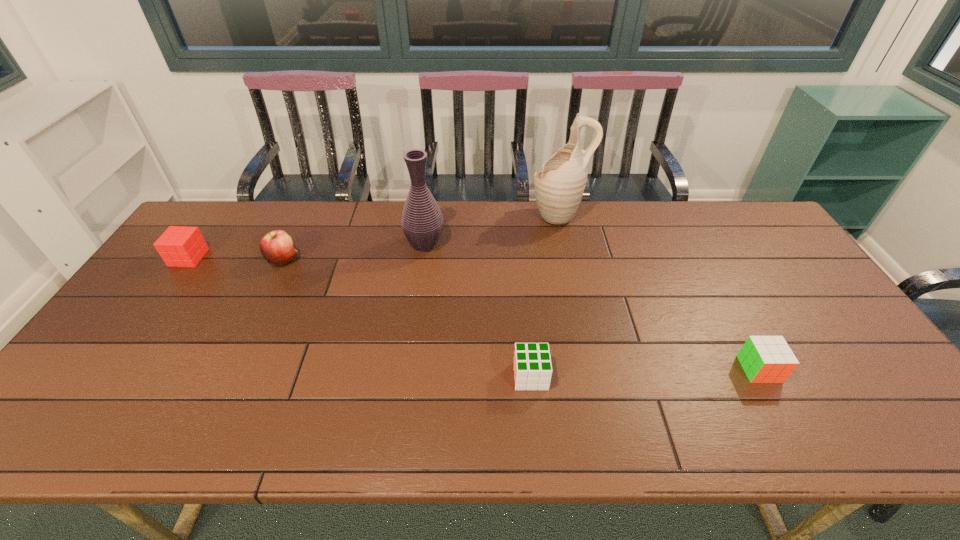
Where is `the second object from right to left`? the second object from right to left is located at coordinates (559, 186).

You are a GUI agent. You are given a task and a screenshot of the screen. Output one action in this format:
    pyautogui.click(x=<x>, y=<y>)
    Task: Click on the farthest object
    The image size is (960, 540).
    Given the screenshot: What is the action you would take?
    pyautogui.click(x=559, y=186)

Find the location of a particular element. Image resolution: width=960 pixels, height=540 pixels. the fourth object from right to left is located at coordinates (422, 222).

Where is `the second object from left to right`? The image size is (960, 540). the second object from left to right is located at coordinates [276, 247].

At what (x,y) coordinates should I click in order to perform the action: click on the fourth shortest object. Please return your answer as a coordinate pair (x, y). Image resolution: width=960 pixels, height=540 pixels. Looking at the image, I should click on (276, 247).

Find the location of a particular element. Image resolution: width=960 pixels, height=540 pixels. the leftmost object is located at coordinates (180, 246).

What are the coordinates of `the leftmost cube` in the screenshot? It's located at (180, 246).

Image resolution: width=960 pixels, height=540 pixels. Find the location of `the third object from right to left`. the third object from right to left is located at coordinates (532, 365).

At what (x,y) coordinates should I click in order to perform the action: click on the rightmost cube. Please return your answer as a coordinate pair (x, y). Image resolution: width=960 pixels, height=540 pixels. Looking at the image, I should click on (765, 359).

The image size is (960, 540). Find the location of `free space located 0.400m at the spout of the fifth object from left to right`. free space located 0.400m at the spout of the fifth object from left to right is located at coordinates (416, 215).